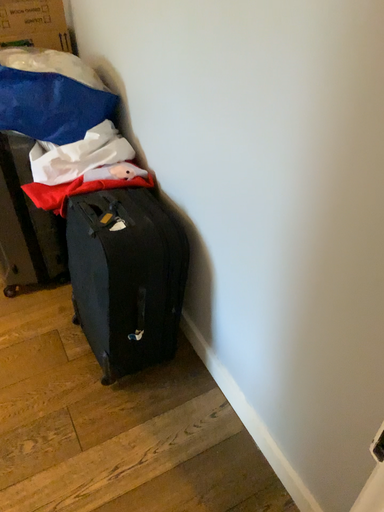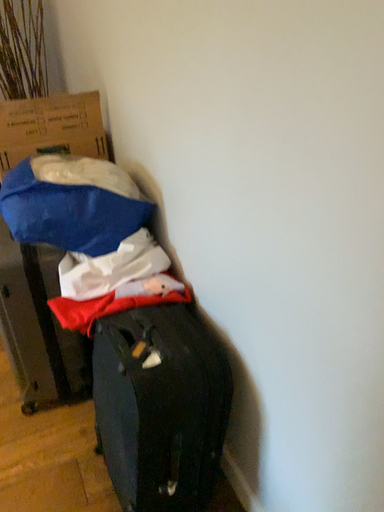
Question: Which way did the camera rotate in the video?

Choices:
 (A) rotated downward
 (B) rotated upward

Answer: (B)